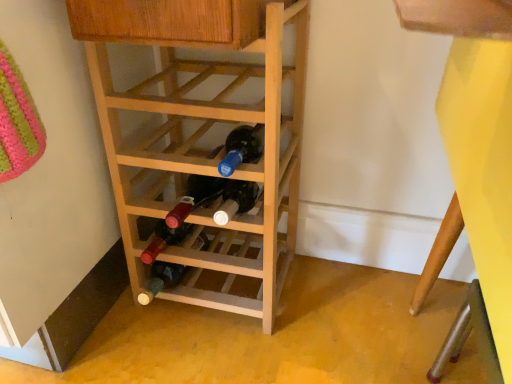
Where is `yellow matte bunk bed at lower right`? The width and height of the screenshot is (512, 384). yellow matte bunk bed at lower right is located at coordinates (474, 169).

What is the approximate height of yellow matte bunk bed at lower right?

It is 27.62 inches.

Measure the distance between point (476, 23) and camera.

Point (476, 23) and camera are 8.19 inches apart.

This screenshot has height=384, width=512. Describe the element at coordinates (474, 169) in the screenshot. I see `yellow matte bunk bed at lower right` at that location.

What do you see at coordinates (204, 132) in the screenshot? The height and width of the screenshot is (384, 512). I see `natural wood wine rack at center` at bounding box center [204, 132].

Where is `natural wood wine rack at center`? This screenshot has height=384, width=512. natural wood wine rack at center is located at coordinates (204, 132).

Find the location of a particular element. This screenshot has width=512, height=384. yellow matte bunk bed at lower right is located at coordinates (474, 169).

Considering the relative positions of yellow matte bunk bed at lower right and natural wood wine rack at center in the image provided, is yellow matte bunk bed at lower right to the right of natural wood wine rack at center from the viewer's perspective?

Correct, you'll find yellow matte bunk bed at lower right to the right of natural wood wine rack at center.

In the image, is yellow matte bunk bed at lower right positioned in front of or behind natural wood wine rack at center?

yellow matte bunk bed at lower right is in front of natural wood wine rack at center.

Does point (437, 11) appear closer or farther from the camera than point (197, 130)?

Point (437, 11).

From the image's perspective, between yellow matte bunk bed at lower right and natural wood wine rack at center, who is located below?

yellow matte bunk bed at lower right appears lower in the image.

From a real-world perspective, is yellow matte bunk bed at lower right located higher than natural wood wine rack at center?

Yes, from a real-world perspective, yellow matte bunk bed at lower right is on top of natural wood wine rack at center.

Between yellow matte bunk bed at lower right and natural wood wine rack at center, which one has larger width?

Wider between the two is natural wood wine rack at center.

Is yellow matte bunk bed at lower right taller or shorter than natural wood wine rack at center?

Clearly, yellow matte bunk bed at lower right is taller compared to natural wood wine rack at center.

Is yellow matte bunk bed at lower right smaller than natural wood wine rack at center?

Actually, yellow matte bunk bed at lower right might be larger than natural wood wine rack at center.

Would you say yellow matte bunk bed at lower right is outside natural wood wine rack at center?

Yes, yellow matte bunk bed at lower right is located beyond the bounds of natural wood wine rack at center.

Can you see yellow matte bunk bed at lower right touching natural wood wine rack at center?

yellow matte bunk bed at lower right and natural wood wine rack at center are clearly separated.

Is yellow matte bunk bed at lower right oriented away from natural wood wine rack at center?

No, natural wood wine rack at center is not at the back of yellow matte bunk bed at lower right.

How far apart are yellow matte bunk bed at lower right and natural wood wine rack at center?

16.91 inches.

I want to click on shelf that appears above the yellow matte bunk bed at lower right (from the image's perspective), so click(204, 132).

Considering the positions of objects natural wood wine rack at center and yellow matte bunk bed at lower right in the image provided, who is more to the right, natural wood wine rack at center or yellow matte bunk bed at lower right?

yellow matte bunk bed at lower right.

Which is in front, natural wood wine rack at center or yellow matte bunk bed at lower right?

yellow matte bunk bed at lower right is closer to the camera.

Is point (270, 70) closer or farther from the camera than point (486, 70)?

Point (270, 70) appears to be farther away from the viewer than point (486, 70).

From the image's perspective, is natural wood wine rack at center located beneath yellow matte bunk bed at lower right?

Actually, natural wood wine rack at center appears above yellow matte bunk bed at lower right in the image.

From a real-world perspective, who is located higher, natural wood wine rack at center or yellow matte bunk bed at lower right?

yellow matte bunk bed at lower right is physically above.

Looking at this image, in terms of width, does natural wood wine rack at center look wider or thinner when compared to yellow matte bunk bed at lower right?

In the image, natural wood wine rack at center appears to be wider than yellow matte bunk bed at lower right.

Which of these two, natural wood wine rack at center or yellow matte bunk bed at lower right, stands shorter?

natural wood wine rack at center is shorter.

Who is bigger, natural wood wine rack at center or yellow matte bunk bed at lower right?

yellow matte bunk bed at lower right is bigger.

Is yellow matte bunk bed at lower right inside natural wood wine rack at center?

No.

Is there a large distance between natural wood wine rack at center and yellow matte bunk bed at lower right?

They are positioned close to each other.

Is natural wood wine rack at center oriented towards yellow matte bunk bed at lower right?

No.

In the scene shown: How many degrees apart are the facing directions of natural wood wine rack at center and yellow matte bunk bed at lower right?

The angular difference between natural wood wine rack at center and yellow matte bunk bed at lower right is 89.3 degrees.

Where is `shelf that is above the yellow matte bunk bed at lower right (from the image's perspective)`? The width and height of the screenshot is (512, 384). shelf that is above the yellow matte bunk bed at lower right (from the image's perspective) is located at coordinates (204, 132).

At what (x,y) coordinates should I click in order to perform the action: click on shelf on the left of yellow matte bunk bed at lower right. Please return your answer as a coordinate pair (x, y). This screenshot has height=384, width=512. Looking at the image, I should click on (204, 132).

You are a GUI agent. You are given a task and a screenshot of the screen. Output one action in this format:
    pyautogui.click(x=<x>, y=<y>)
    Task: Click on the bunk bed above the natural wood wine rack at center (from a real-world perspective)
    Image resolution: width=512 pixels, height=384 pixels.
    Given the screenshot: What is the action you would take?
    pyautogui.click(x=474, y=169)